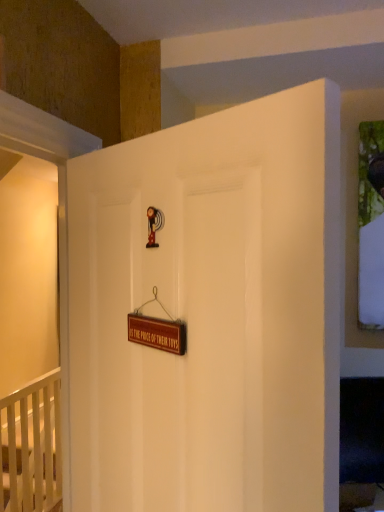
Question: Is white wooden crib at lower left outside white matte door at center?

Choices:
 (A) yes
 (B) no

Answer: (A)

Question: Is white wooden crib at lower left oriented towards white matte door at center?

Choices:
 (A) no
 (B) yes

Answer: (A)

Question: Is white wooden crib at lower left positioned behind white matte door at center?

Choices:
 (A) yes
 (B) no

Answer: (A)

Question: Is white wooden crib at lower left beside white matte door at center?

Choices:
 (A) yes
 (B) no

Answer: (B)

Question: From a real-world perspective, does white wooden crib at lower left sit lower than white matte door at center?

Choices:
 (A) yes
 (B) no

Answer: (A)

Question: Does white wooden crib at lower left have a lesser width compared to white matte door at center?

Choices:
 (A) yes
 (B) no

Answer: (B)

Question: From a real-world perspective, is white wooden crib at lower left positioned under brown wooden sign at center based on gravity?

Choices:
 (A) yes
 (B) no

Answer: (A)

Question: Does white wooden crib at lower left have a lesser width compared to brown wooden sign at center?

Choices:
 (A) no
 (B) yes

Answer: (A)

Question: Are white wooden crib at lower left and brown wooden sign at center located far from each other?

Choices:
 (A) no
 (B) yes

Answer: (B)

Question: From the image's perspective, is white wooden crib at lower left below brown wooden sign at center?

Choices:
 (A) yes
 (B) no

Answer: (A)

Question: Is brown wooden sign at center at the back of white wooden crib at lower left?

Choices:
 (A) no
 (B) yes

Answer: (A)

Question: Is white wooden crib at lower left behind brown wooden sign at center?

Choices:
 (A) no
 (B) yes

Answer: (B)

Question: Does white matte door at center appear on the right side of brown wooden sign at center?

Choices:
 (A) yes
 (B) no

Answer: (A)